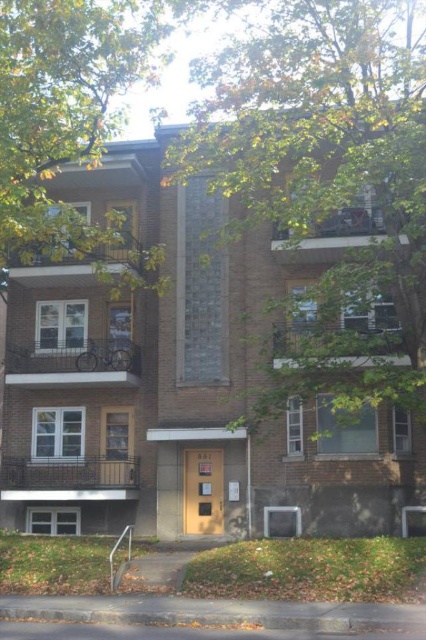
Please provide the exact 2D coordinates of the green leafy tree at upper center in the image.

The green leafy tree at upper center is located at coordinates [328,184].

You are a window washer standing on the roof of the residential building. You need to clean the windows on the highest floor. Which tree, the green leafy tree at upper center or the green leafy tree at upper left, might pose a greater obstruction due to its height?

The green leafy tree at upper center has a greater height compared to the green leafy tree at upper left, so it might pose a greater obstruction due to its height.